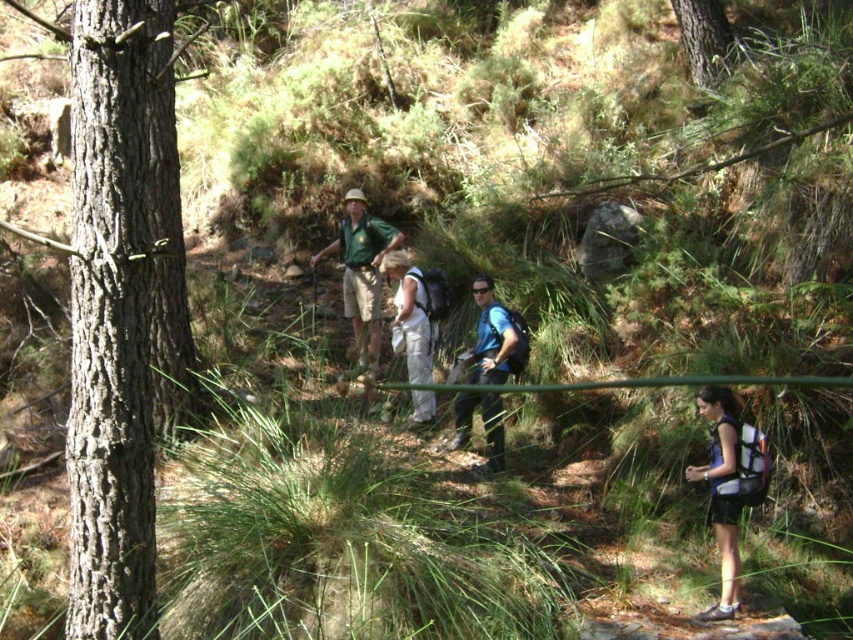
Question: Is gray rough bark tree at left above matte khaki shorts at center?

Choices:
 (A) yes
 (B) no

Answer: (B)

Question: Among these points, which one is nearest to the camera?

Choices:
 (A) (392, 332)
 (B) (142, 220)
 (C) (517, 364)

Answer: (B)

Question: Can you confirm if gray rough bark tree at left is positioned to the right of smooth bark tree at upper center?

Choices:
 (A) yes
 (B) no

Answer: (B)

Question: Estimate the real-world distances between objects in this image. Which object is closer to the blue fabric backpack at lower right?

Choices:
 (A) smooth bark tree at upper center
 (B) gray rough bark tree at left
 (C) blue fabric backpack at center
 (D) matte khaki shorts at center

Answer: (C)

Question: Which of these objects is positioned farthest from the white fabric pants at center?

Choices:
 (A) blue fabric backpack at center
 (B) smooth bark tree at upper center

Answer: (B)

Question: Can you confirm if gray rough bark tree at left is positioned above blue fabric backpack at lower right?

Choices:
 (A) no
 (B) yes

Answer: (B)